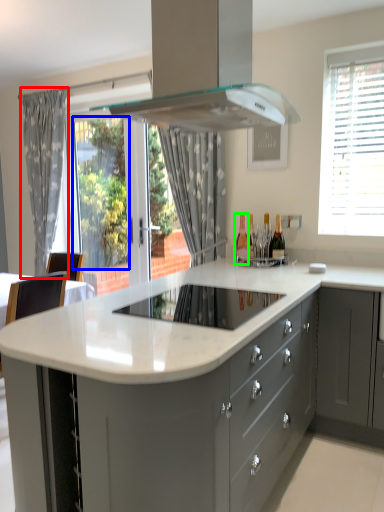
Question: Which object is the farthest from curtain (highlighted by a red box)? Choose among these: window screen (highlighted by a blue box) or bottle (highlighted by a green box).

Choices:
 (A) window screen
 (B) bottle

Answer: (B)